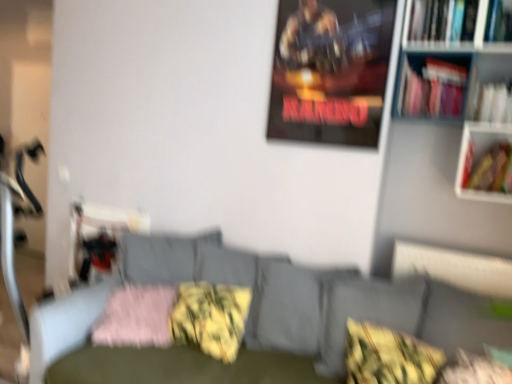
Question: Does yellow-green textured pillow at lower right, placed as the first pillow when sorted from right to left, come in front of hardcover book at right, the third book positioned from the top?

Choices:
 (A) no
 (B) yes

Answer: (B)

Question: From the image's perspective, is yellow-green textured pillow at lower right, acting as the fourth pillow starting from the left, below hardcover book at right, placed as the 1th book when sorted from bottom to top?

Choices:
 (A) yes
 (B) no

Answer: (A)

Question: Are yellow-green textured pillow at lower right, acting as the fourth pillow starting from the left, and hardcover book at right, placed as the 1th book when sorted from bottom to top, far apart?

Choices:
 (A) no
 (B) yes

Answer: (A)

Question: Is yellow-green textured pillow at lower right, acting as the fourth pillow starting from the left, with hardcover book at right, placed as the 1th book when sorted from bottom to top?

Choices:
 (A) no
 (B) yes

Answer: (A)

Question: Is yellow-green textured pillow at lower right, acting as the fourth pillow starting from the left, facing towards hardcover book at right, the third book positioned from the top?

Choices:
 (A) yes
 (B) no

Answer: (B)

Question: From the image's perspective, does yellow-green textured pillow at lower right, acting as the fourth pillow starting from the left, appear higher than hardcover book at right, placed as the 1th book when sorted from bottom to top?

Choices:
 (A) yes
 (B) no

Answer: (B)

Question: Is hardcover book at upper right, the first book viewed from the top, smaller than pink fluffy pillow at lower left, the first pillow viewed from the left?

Choices:
 (A) yes
 (B) no

Answer: (A)

Question: From a real-world perspective, is hardcover book at upper right, acting as the 3th book starting from the bottom, physically above pink fluffy pillow at lower left, arranged as the 4th pillow when viewed from the right?

Choices:
 (A) no
 (B) yes

Answer: (B)

Question: Is hardcover book at upper right, the first book viewed from the top, closer to camera compared to pink fluffy pillow at lower left, the first pillow viewed from the left?

Choices:
 (A) no
 (B) yes

Answer: (B)

Question: Does hardcover book at upper right, the first book viewed from the top, have a lesser width compared to pink fluffy pillow at lower left, arranged as the 4th pillow when viewed from the right?

Choices:
 (A) no
 (B) yes

Answer: (B)

Question: Is hardcover book at upper right, acting as the 3th book starting from the bottom, shorter than pink fluffy pillow at lower left, arranged as the 4th pillow when viewed from the right?

Choices:
 (A) yes
 (B) no

Answer: (B)

Question: Is hardcover book at upper right, the first book viewed from the top, not near pink fluffy pillow at lower left, arranged as the 4th pillow when viewed from the right?

Choices:
 (A) yes
 (B) no

Answer: (A)

Question: Is the depth of pink fluffy pillow at lower left, arranged as the 4th pillow when viewed from the right, less than that of textured gray couch at center?

Choices:
 (A) yes
 (B) no

Answer: (B)